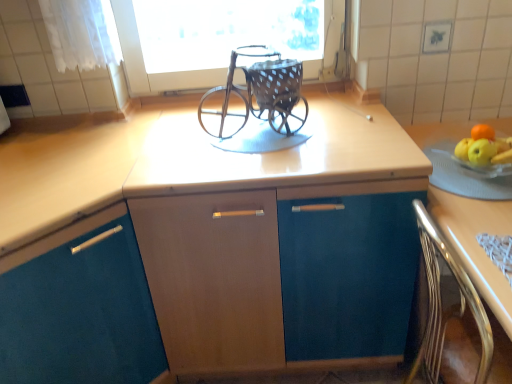
Find the location of a particular element. This screenshot has height=384, width=512. metallic polished chair at lower right is located at coordinates (441, 305).

What do you see at coordinates (441, 305) in the screenshot?
I see `metallic polished chair at lower right` at bounding box center [441, 305].

Looking at this image, measure the distance between teal matte cabinet at center, arranged as the 1th cabinetry when viewed from the left, and camera.

They are 37.65 inches apart.

At what (x,y) coordinates should I click in order to perform the action: click on rustic metal baby carriage at center. Please return your answer as a coordinate pair (x, y). Image resolution: width=512 pixels, height=384 pixels. Looking at the image, I should click on coord(262,93).

How different are the orientations of rustic metal baby carriage at center and light brown wood at right in degrees?

There is a 89.8-degree angle between the facing directions of rustic metal baby carriage at center and light brown wood at right.

Which of these two, rustic metal baby carriage at center or light brown wood at right, stands taller?

Standing taller between the two is light brown wood at right.

Are rustic metal baby carriage at center and light brown wood at right far apart?

No, rustic metal baby carriage at center is not far away from light brown wood at right.

Identify the location of countertop below the rustic metal baby carriage at center (from the image's perspective). (476, 244).

From a real-world perspective, which cabinetry is the 1st one above the light brown wood at right? Please provide its 2D coordinates.

[(281, 273)]

Does light brown wood at right have a lesser height compared to matte wood cabinet at center, acting as the first cabinetry starting from the right?

Correct, light brown wood at right is not as tall as matte wood cabinet at center, acting as the first cabinetry starting from the right.

From the image's perspective, is light brown wood at right located above matte wood cabinet at center, acting as the first cabinetry starting from the right?

Incorrect, from the image's perspective, light brown wood at right is lower than matte wood cabinet at center, acting as the first cabinetry starting from the right.

Which object is closer to the camera, light brown wood at right or matte wood cabinet at center, the second cabinetry viewed from the left?

light brown wood at right is closer to the camera.

Does teal matte cabinet at center, the second cabinetry when ordered from right to left, appear on the left side of rustic metal baby carriage at center?

Yes, teal matte cabinet at center, the second cabinetry when ordered from right to left, is to the left of rustic metal baby carriage at center.

From the image's perspective, which cabinetry is the 2nd one below the rustic metal baby carriage at center? Please provide its 2D coordinates.

[(79, 308)]

From the image's perspective, is teal matte cabinet at center, arranged as the 1th cabinetry when viewed from the left, positioned above or below rustic metal baby carriage at center?

Based on their image positions, teal matte cabinet at center, arranged as the 1th cabinetry when viewed from the left, is located beneath rustic metal baby carriage at center.

Which is closer, (86, 292) or (266, 79)?

The point (86, 292) is closer.

From a real-world perspective, is matte wood cabinet at center, acting as the first cabinetry starting from the right, below rustic metal baby carriage at center?

Yes, from a real-world perspective, matte wood cabinet at center, acting as the first cabinetry starting from the right, is below rustic metal baby carriage at center.

Does matte wood cabinet at center, the second cabinetry viewed from the left, have a greater width compared to rustic metal baby carriage at center?

Yes.

Is matte wood cabinet at center, acting as the first cabinetry starting from the right, bigger or smaller than rustic metal baby carriage at center?

matte wood cabinet at center, acting as the first cabinetry starting from the right, is bigger than rustic metal baby carriage at center.

Is point (261, 337) more distant than point (244, 102)?

No, (261, 337) is in front of (244, 102).

Considering the points (153, 232) and (468, 243), which point is behind, point (153, 232) or point (468, 243)?

The point (153, 232) is farther.

Is matte wood cabinet at center, the second cabinetry viewed from the left, taller or shorter than light brown wood at right?

Considering their sizes, matte wood cabinet at center, the second cabinetry viewed from the left, has more height than light brown wood at right.

Measure the distance between matte wood cabinet at center, the second cabinetry viewed from the left, and light brown wood at right.

48.62 centimeters.

Could you tell me if matte wood cabinet at center, acting as the first cabinetry starting from the right, is turned towards light brown wood at right?

No, matte wood cabinet at center, acting as the first cabinetry starting from the right, is not facing towards light brown wood at right.

Find the location of a particular element. chair below the matte wood cabinet at center, acting as the first cabinetry starting from the right (from the image's perspective) is located at coordinates (441, 305).

Considering the sizes of objects matte wood cabinet at center, acting as the first cabinetry starting from the right, and metallic polished chair at lower right in the image provided, who is taller, matte wood cabinet at center, acting as the first cabinetry starting from the right, or metallic polished chair at lower right?

matte wood cabinet at center, acting as the first cabinetry starting from the right.

In the scene shown: Which of these two, matte wood cabinet at center, the second cabinetry viewed from the left, or metallic polished chair at lower right, is bigger?

matte wood cabinet at center, the second cabinetry viewed from the left.

Looking at this image, is matte wood cabinet at center, acting as the first cabinetry starting from the right, not near metallic polished chair at lower right?

No, matte wood cabinet at center, acting as the first cabinetry starting from the right, is not far from metallic polished chair at lower right.

Is point (426, 375) more distant than point (271, 97)?

No, (426, 375) is closer to viewer.

From the image's perspective, is metallic polished chair at lower right on rustic metal baby carriage at center?

No, from the image's perspective, metallic polished chair at lower right is not above rustic metal baby carriage at center.

Is metallic polished chair at lower right oriented towards rustic metal baby carriage at center?

No, metallic polished chair at lower right does not turn towards rustic metal baby carriage at center.

Identify the location of baby carriage that appears behind the light brown wood at right. (262, 93).

Where is `countertop on the right of matte wood cabinet at center, acting as the first cabinetry starting from the right`? The height and width of the screenshot is (384, 512). countertop on the right of matte wood cabinet at center, acting as the first cabinetry starting from the right is located at coordinates (476, 244).

When comparing their distances from rustic metal baby carriage at center, does matte wood cabinet at center, the second cabinetry viewed from the left, or metallic polished chair at lower right seem further?

Among the two, metallic polished chair at lower right is located further to rustic metal baby carriage at center.

Considering their positions, is metallic polished chair at lower right positioned further to teal matte cabinet at center, the second cabinetry when ordered from right to left, than matte wood cabinet at center, acting as the first cabinetry starting from the right?

metallic polished chair at lower right lies further to teal matte cabinet at center, the second cabinetry when ordered from right to left, than the other object.

From the image, which object appears to be nearer to matte wood cabinet at center, acting as the first cabinetry starting from the right, metallic polished chair at lower right or teal matte cabinet at center, arranged as the 1th cabinetry when viewed from the left?

Result: teal matte cabinet at center, arranged as the 1th cabinetry when viewed from the left, lies closer to matte wood cabinet at center, acting as the first cabinetry starting from the right, than the other object.

When comparing their distances from rustic metal baby carriage at center, does metallic polished chair at lower right or light brown wood at right seem further?

metallic polished chair at lower right.

Based on their spatial positions, is light brown wood at right or rustic metal baby carriage at center closer to teal matte cabinet at center, arranged as the 1th cabinetry when viewed from the left?

The object closer to teal matte cabinet at center, arranged as the 1th cabinetry when viewed from the left, is rustic metal baby carriage at center.

Based on their spatial positions, is light brown wood at right or rustic metal baby carriage at center closer to metallic polished chair at lower right?

Among the two, light brown wood at right is located nearer to metallic polished chair at lower right.

Considering their positions, is matte wood cabinet at center, the second cabinetry viewed from the left, positioned further to metallic polished chair at lower right than rustic metal baby carriage at center?

rustic metal baby carriage at center is further to metallic polished chair at lower right.

Estimate the real-world distances between objects in this image. Which object is further from matte wood cabinet at center, the second cabinetry viewed from the left, teal matte cabinet at center, the second cabinetry when ordered from right to left, or light brown wood at right?

light brown wood at right.

This screenshot has width=512, height=384. Identify the location of baby carriage situated between teal matte cabinet at center, the second cabinetry when ordered from right to left, and metallic polished chair at lower right from left to right. (262, 93).

You are a GUI agent. You are given a task and a screenshot of the screen. Output one action in this format:
    pyautogui.click(x=<x>, y=<y>)
    Task: Click on the cabinetry between teal matte cabinet at center, the second cabinetry when ordered from right to left, and light brown wood at right, in the horizontal direction
    
    Given the screenshot: What is the action you would take?
    pyautogui.click(x=281, y=273)

This screenshot has height=384, width=512. In order to click on chair between teal matte cabinet at center, the second cabinetry when ordered from right to left, and light brown wood at right in this screenshot , I will do `click(441, 305)`.

Where is `chair located between matte wood cabinet at center, the second cabinetry viewed from the left, and light brown wood at right in the left-right direction`? The width and height of the screenshot is (512, 384). chair located between matte wood cabinet at center, the second cabinetry viewed from the left, and light brown wood at right in the left-right direction is located at coordinates [441, 305].